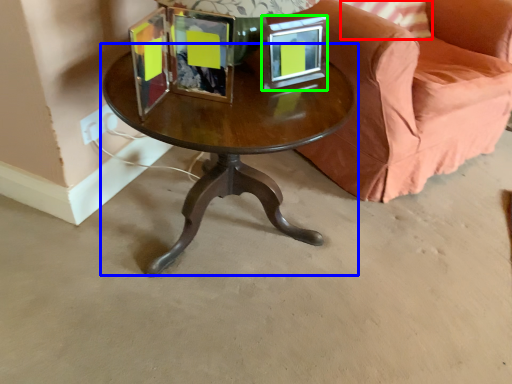
Question: Which object is positioned farthest from pillow (highlighted by a red box)? Select from coffee table (highlighted by a blue box) and picture frame (highlighted by a green box).

Choices:
 (A) coffee table
 (B) picture frame

Answer: (A)